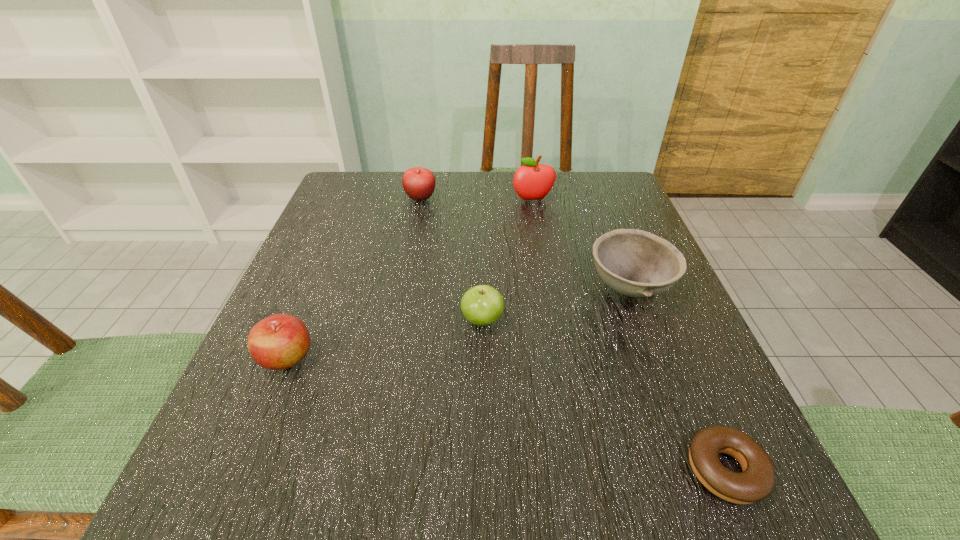
At what (x,y) coordinates should I click in order to perform the action: click on vacant space located 0.390m on the front of the fourth object from left to right. Please return your answer as a coordinate pair (x, y). Looking at the image, I should click on (554, 324).

This screenshot has width=960, height=540. What are the coordinates of `vacant space located 0.080m on the left of the fifth object from right to left` in the screenshot? It's located at (372, 198).

Image resolution: width=960 pixels, height=540 pixels. In order to click on free space located on the front of the third farthest apple in this screenshot , I will do `click(483, 381)`.

Find the location of `vacant space situated on the front of the second nearest object`. vacant space situated on the front of the second nearest object is located at coordinates (244, 464).

Locate an element on the screen. free location located on the front of the bowl is located at coordinates (709, 497).

Locate an element on the screen. free space located on the left of the shortest object is located at coordinates (386, 470).

This screenshot has width=960, height=540. In order to click on object that is at the near edge in this screenshot , I will do `click(756, 482)`.

Locate an element on the screen. object that is at the left edge is located at coordinates (280, 341).

Identify the location of bowl present at the right edge. Image resolution: width=960 pixels, height=540 pixels. (635, 263).

Where is `doughnut located in the right edge section of the desktop`? doughnut located in the right edge section of the desktop is located at coordinates (756, 482).